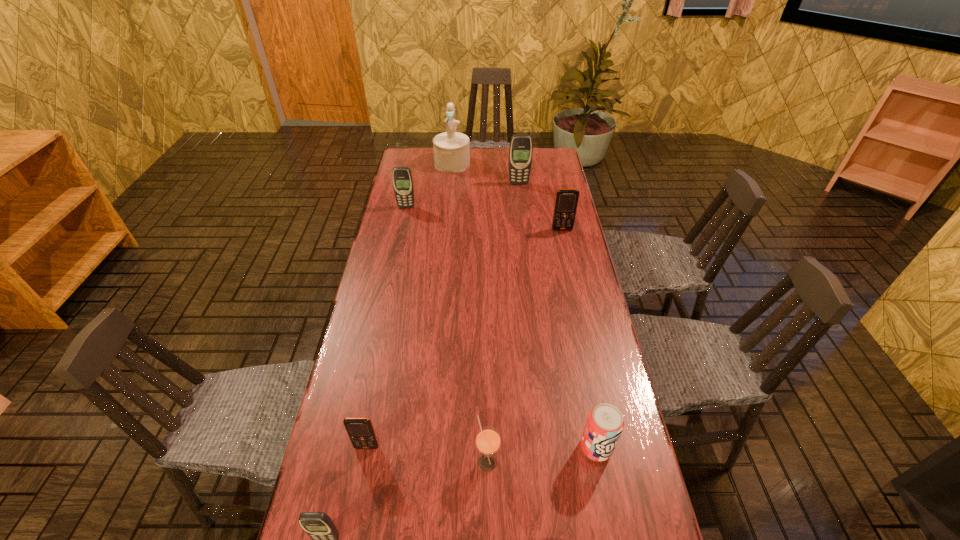
This screenshot has height=540, width=960. I want to click on figurine, so click(x=451, y=149).

Find the location of `white figurine`. white figurine is located at coordinates (451, 149).

In order to click on the sixth object from left to right in this screenshot , I will do `click(521, 146)`.

The image size is (960, 540). In order to click on the second cellular telephone from right to left in this screenshot , I will do `click(521, 146)`.

The image size is (960, 540). What are the coordinates of `the second farthest gray cellular telephone` in the screenshot? It's located at (402, 179).

I want to click on the sixth nearest object, so click(402, 179).

This screenshot has width=960, height=540. In order to click on the farther orange cellular telephone in this screenshot , I will do `click(566, 201)`.

Locate an element on the screen. the rightmost cellular telephone is located at coordinates (566, 201).

Image resolution: width=960 pixels, height=540 pixels. Identify the location of straw. (488, 440).

At what (x,y) coordinates should I click in order to perform the action: click on soda can. Please return your answer as a coordinate pair (x, y). Looking at the image, I should click on (604, 425).